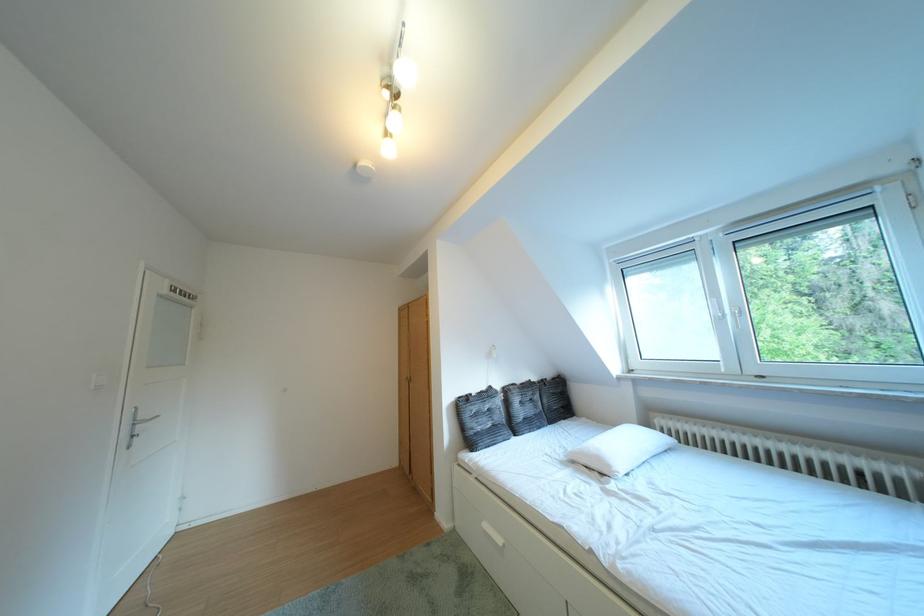
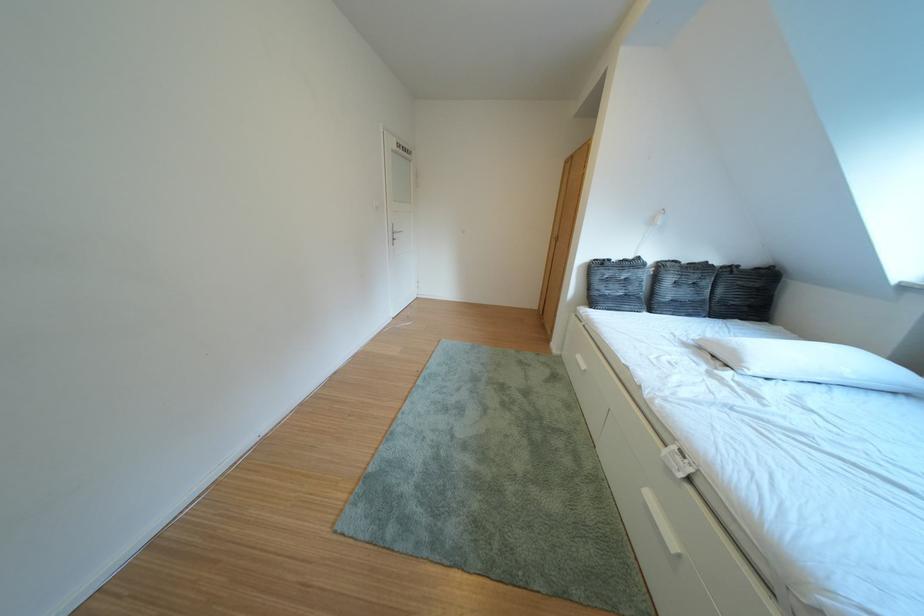
Based on the continuous images, in which direction is the camera rotating?

The rotation direction of the camera is left-down.